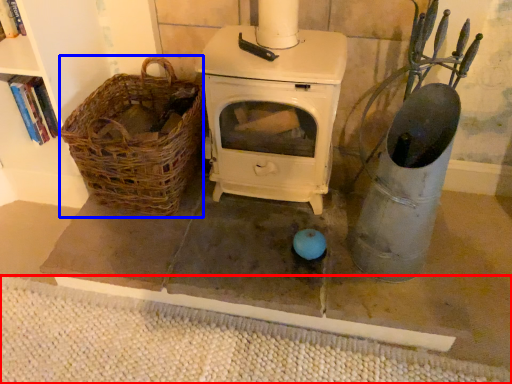
Question: Which point is closer to the camera, mat (highlighted by a red box) or basket (highlighted by a blue box)?

Choices:
 (A) mat
 (B) basket

Answer: (A)